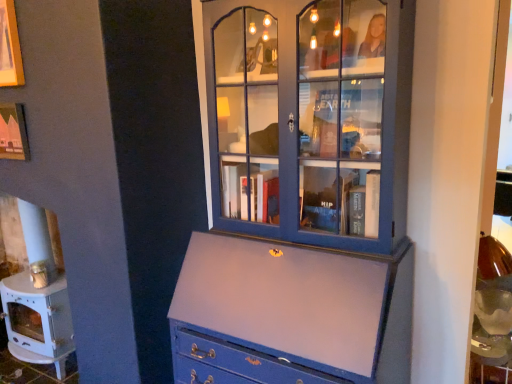
Question: From the image's perspective, is blue painted wood cabinet at center above or below white glossy fireplace at lower left?

Choices:
 (A) above
 (B) below

Answer: (A)

Question: In terms of height, does blue painted wood cabinet at center look taller or shorter compared to white glossy fireplace at lower left?

Choices:
 (A) short
 (B) tall

Answer: (B)

Question: Is blue painted wood cabinet at center to the left or to the right of white glossy fireplace at lower left in the image?

Choices:
 (A) right
 (B) left

Answer: (A)

Question: Looking at the image, does white glossy fireplace at lower left seem bigger or smaller compared to blue painted wood cabinet at center?

Choices:
 (A) small
 (B) big

Answer: (A)

Question: From the image's perspective, is white glossy fireplace at lower left positioned above or below blue painted wood cabinet at center?

Choices:
 (A) below
 (B) above

Answer: (A)

Question: Does point (40, 322) appear closer or farther from the camera than point (243, 140)?

Choices:
 (A) closer
 (B) farther

Answer: (B)

Question: From a real-world perspective, is white glossy fireplace at lower left positioned above or below blue painted wood cabinet at center?

Choices:
 (A) below
 (B) above

Answer: (A)